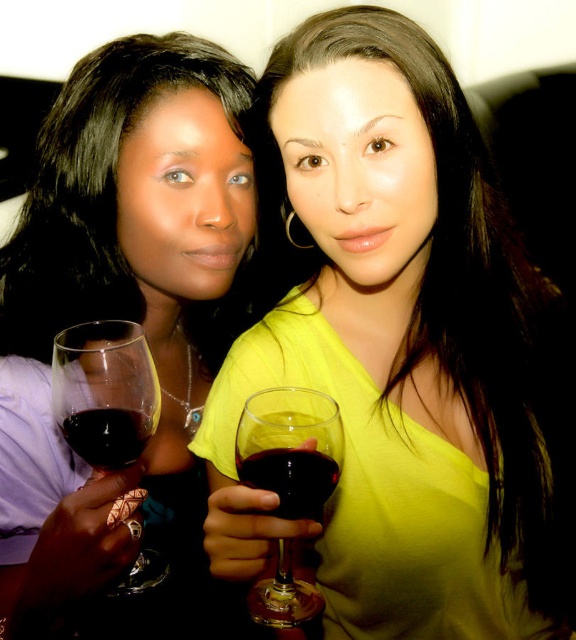
Looking at this image, how distant is matte black wine glass at left from ruby glass at center?

The distance of matte black wine glass at left from ruby glass at center is 13.04 inches.

Locate an element on the screen. matte black wine glass at left is located at coordinates (126, 320).

Does point (234, 161) lie behind point (321, 464)?

That is True.

Locate an element on the screen. This screenshot has height=640, width=576. matte black wine glass at left is located at coordinates (126, 320).

Is point (295, 515) positioned in front of point (146, 429)?

Yes, it is.

Locate an element on the screen. The height and width of the screenshot is (640, 576). ruby glass at center is located at coordinates (291, 477).

Find the location of a particular element. ruby glass at center is located at coordinates (291, 477).

Does matte glass wine at center have a smaller size compared to dark red liquid at center?

Actually, matte glass wine at center might be larger than dark red liquid at center.

The width and height of the screenshot is (576, 640). What do you see at coordinates (395, 348) in the screenshot?
I see `matte glass wine at center` at bounding box center [395, 348].

I want to click on matte glass wine at center, so click(395, 348).